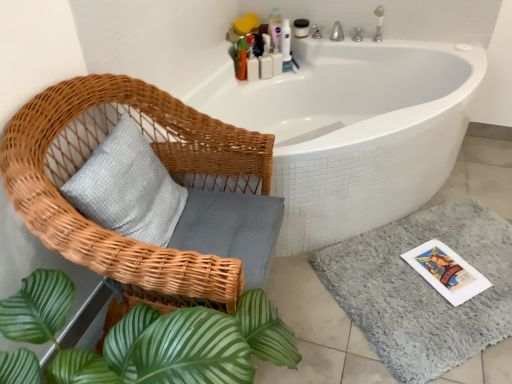
Question: Is matte white jar at upper center, which is counted as the 5th toiletry, starting from the left, smaller than white plastic bottles at upper center, which is the fourth toiletry from right to left?

Choices:
 (A) yes
 (B) no

Answer: (A)

Question: Is white plastic bottles at upper center, which is the fourth toiletry from right to left, completely or partially inside matte white jar at upper center, which is counted as the 5th toiletry, starting from the left?

Choices:
 (A) no
 (B) yes

Answer: (A)

Question: Are matte white jar at upper center, which ranks as the first toiletry in right-to-left order, and white plastic bottles at upper center, which is the fourth toiletry from right to left, making contact?

Choices:
 (A) yes
 (B) no

Answer: (B)

Question: Can you confirm if matte white jar at upper center, which is counted as the 5th toiletry, starting from the left, is taller than white plastic bottles at upper center, which is the fourth toiletry from right to left?

Choices:
 (A) no
 (B) yes

Answer: (A)

Question: Can you confirm if matte white jar at upper center, which is counted as the 5th toiletry, starting from the left, is shorter than white plastic bottles at upper center, which is the fourth toiletry from right to left?

Choices:
 (A) no
 (B) yes

Answer: (B)

Question: Is matte white jar at upper center, which is counted as the 5th toiletry, starting from the left, facing away from white plastic bottles at upper center, which is the fourth toiletry from right to left?

Choices:
 (A) yes
 (B) no

Answer: (B)

Question: Is white plastic bottles at upper center, the second toiletry when ordered from left to right, next to white plastic bottles at upper center, positioned as the second toiletry in right-to-left order?

Choices:
 (A) yes
 (B) no

Answer: (A)

Question: From a real-world perspective, does white plastic bottles at upper center, the second toiletry when ordered from left to right, stand above white plastic bottles at upper center, positioned as the second toiletry in right-to-left order?

Choices:
 (A) no
 (B) yes

Answer: (B)

Question: Is white plastic bottles at upper center, the second toiletry when ordered from left to right, outside of white plastic bottles at upper center, arranged as the fourth toiletry when viewed from the left?

Choices:
 (A) yes
 (B) no

Answer: (A)

Question: From the image's perspective, is white plastic bottles at upper center, which is the fourth toiletry from right to left, located beneath white plastic bottles at upper center, arranged as the fourth toiletry when viewed from the left?

Choices:
 (A) yes
 (B) no

Answer: (A)

Question: Does white plastic bottles at upper center, which is the fourth toiletry from right to left, have a larger size compared to white plastic bottles at upper center, positioned as the second toiletry in right-to-left order?

Choices:
 (A) no
 (B) yes

Answer: (B)

Question: Is white plastic bottles at upper center, which is the fourth toiletry from right to left, smaller than white plastic bottles at upper center, arranged as the fourth toiletry when viewed from the left?

Choices:
 (A) yes
 (B) no

Answer: (B)

Question: Would you say matte white jar at upper center, which is counted as the 5th toiletry, starting from the left, is outside translucent plastic bottles at upper right, the 1th toiletry when ordered from left to right?

Choices:
 (A) no
 (B) yes

Answer: (B)